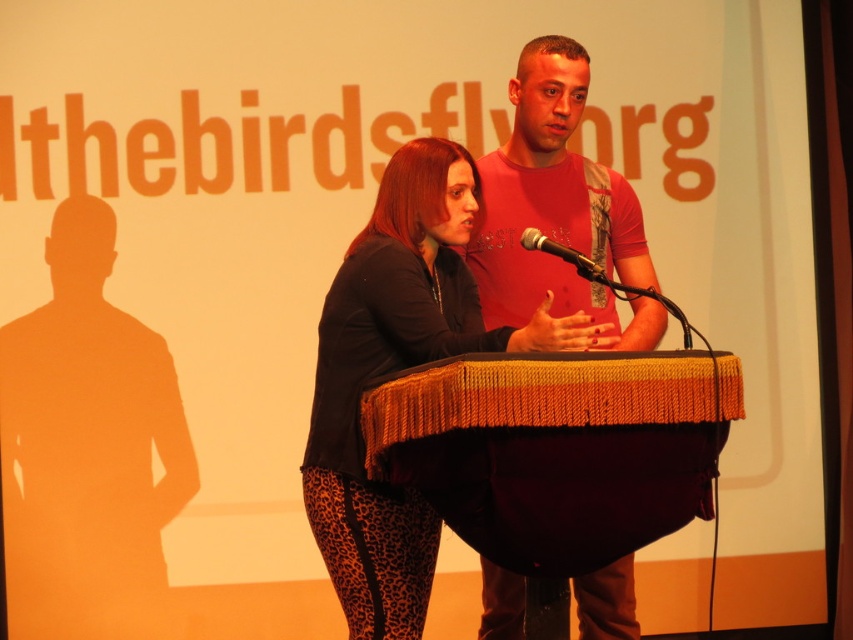
Question: Among these points, which one is nearest to the camera?

Choices:
 (A) (430, 570)
 (B) (550, 109)
 (C) (595, 273)

Answer: (C)

Question: Does black matte jacket at center appear on the right side of matte red t-shirt at center?

Choices:
 (A) yes
 (B) no

Answer: (B)

Question: Can you confirm if black matte jacket at center is positioned above matte red t-shirt at center?

Choices:
 (A) yes
 (B) no

Answer: (B)

Question: Does black matte jacket at center have a larger size compared to metallic silver microphone at center?

Choices:
 (A) no
 (B) yes

Answer: (B)

Question: Among these points, which one is farthest from the camera?

Choices:
 (A) (564, 132)
 (B) (360, 476)
 (C) (531, 230)

Answer: (A)

Question: Which point is closer to the camera taking this photo?

Choices:
 (A) (479, 637)
 (B) (553, 243)
 (C) (514, 340)

Answer: (C)